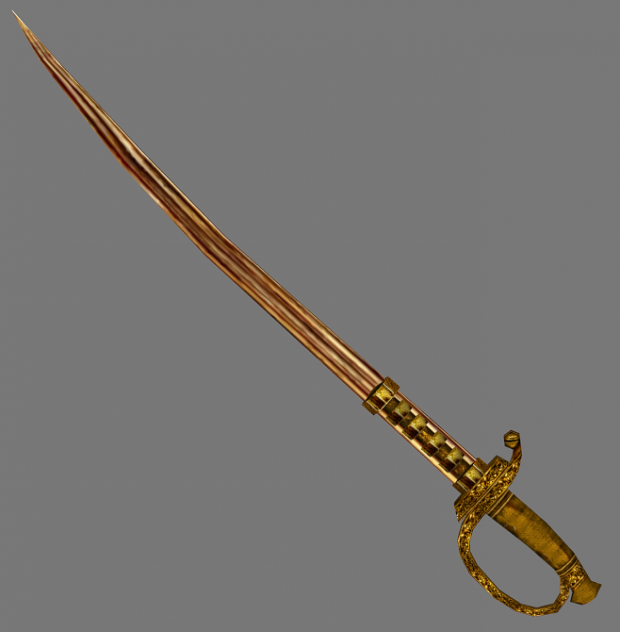
Identify the location of holder. This screenshot has height=632, width=620. (439, 442), (529, 517), (490, 581).